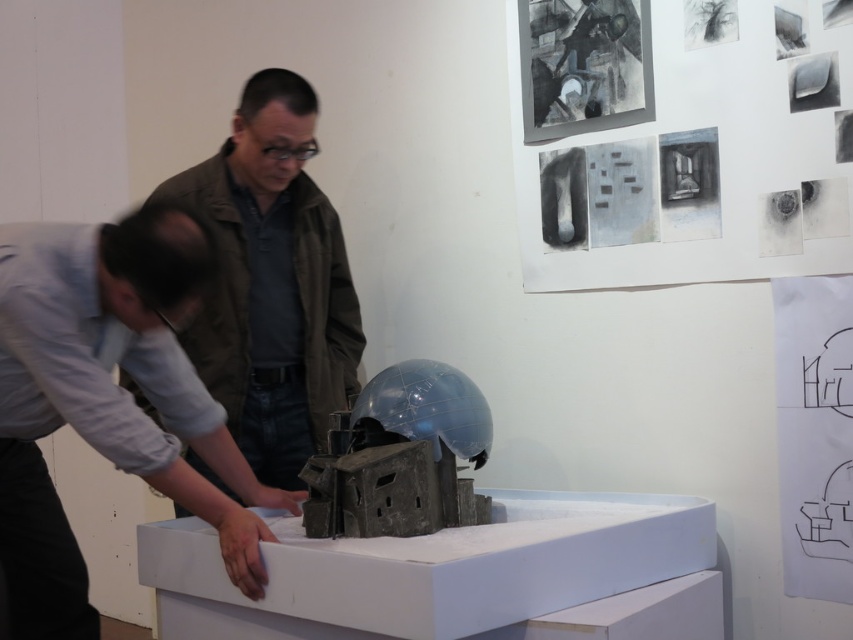
In the scene shown: Is light gray shirt at lower left wider than matte brown jacket at center?

Yes.

Does light gray shirt at lower left appear on the left side of matte brown jacket at center?

Correct, you'll find light gray shirt at lower left to the left of matte brown jacket at center.

The height and width of the screenshot is (640, 853). What do you see at coordinates (107, 401) in the screenshot?
I see `light gray shirt at lower left` at bounding box center [107, 401].

Locate an element on the screen. light gray shirt at lower left is located at coordinates (107, 401).